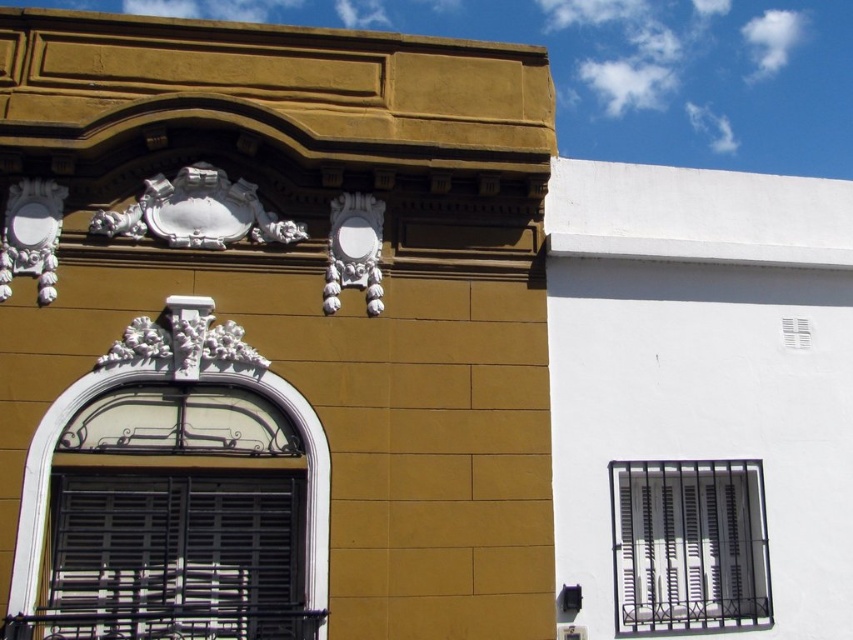
You are an architect analyzing two buildings. You observe the metallic gray bars at center and the white matte window at center. Which object is located to the right of the other?

The metallic gray bars at center is positioned on the right side of white matte window at center.

Looking at this image, you are standing in front of two buildings and want to take a photo of the white matte window at center and the metallic gray bars at center. Which object will appear larger in your camera view?

The metallic gray bars at center will appear larger in your camera view because they are closer to you than the white matte window at center.